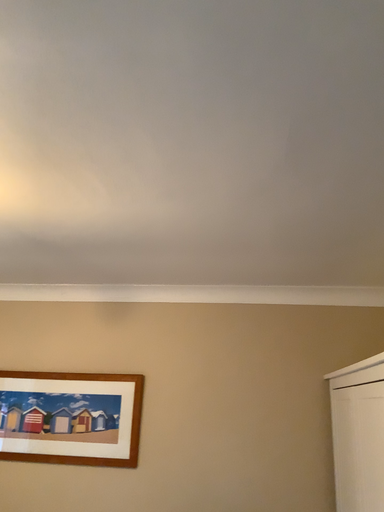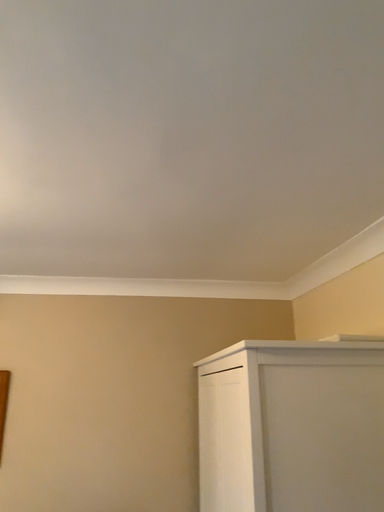
Question: How did the camera likely rotate when shooting the video?

Choices:
 (A) rotated left
 (B) rotated right

Answer: (B)